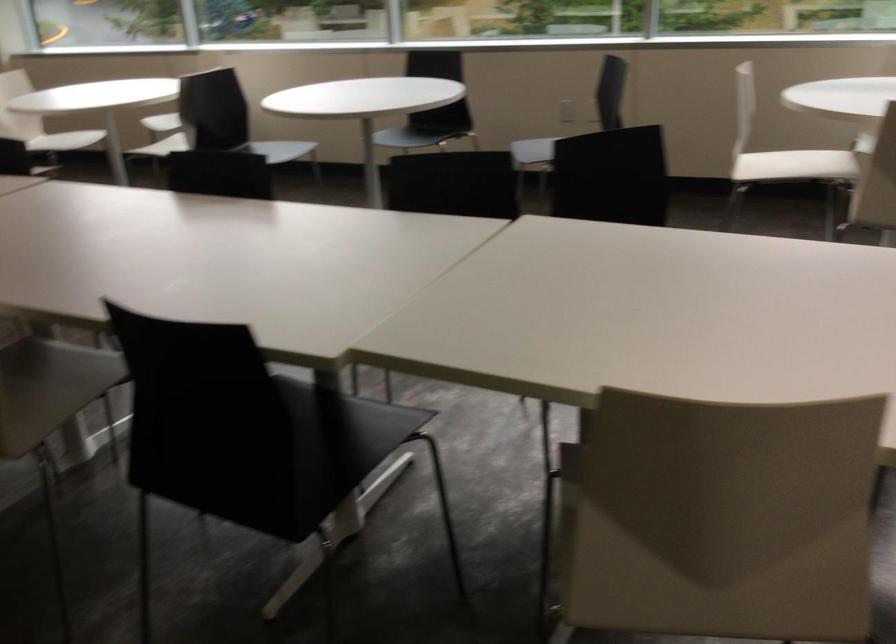
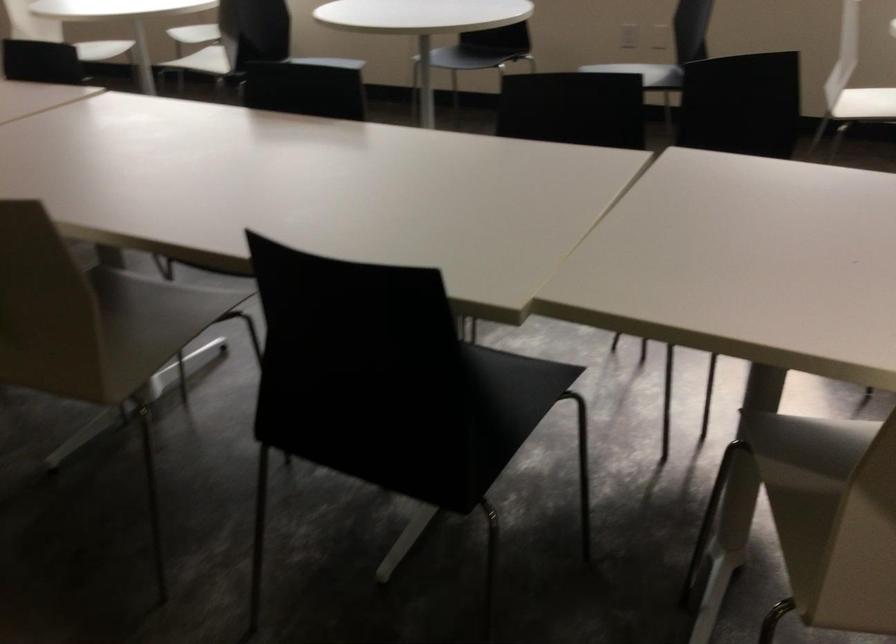
In a continuous first-person perspective shot, in which direction is the camera moving?

The movement direction of the cameraman is left, forward.